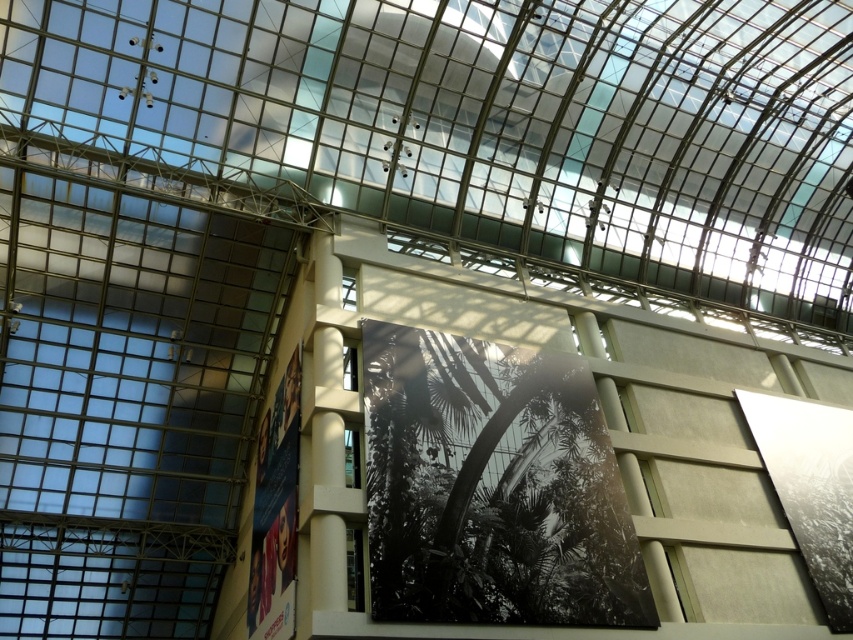
Question: Based on their relative distances, which object is farther from the transparent glass window at lower center?

Choices:
 (A) transparent glass window at upper center
 (B) transparent glass window at center

Answer: (A)

Question: Which object appears farthest from the camera in this image?

Choices:
 (A) transparent glass window at lower center
 (B) transparent glass window at center

Answer: (B)

Question: Which of these objects is positioned closest to the transparent glass window at lower center?

Choices:
 (A) transparent glass window at upper center
 (B) clear glass window at center
 (C) transparent glass window at center

Answer: (B)

Question: Does transparent glass window at lower center have a larger size compared to transparent glass window at upper center?

Choices:
 (A) no
 (B) yes

Answer: (B)

Question: From the image, what is the correct spatial relationship of transparent glass window at lower center in relation to transparent glass window at center?

Choices:
 (A) left
 (B) right

Answer: (B)

Question: Can you confirm if transparent glass window at upper center is thinner than transparent glass window at center?

Choices:
 (A) yes
 (B) no

Answer: (A)